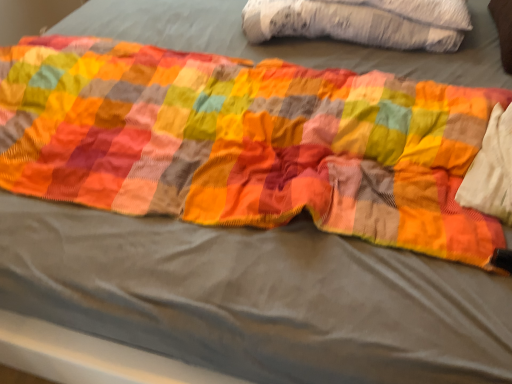
Question: Should I look upward or downward to see white textured pillow at upper center?

Choices:
 (A) down
 (B) up

Answer: (B)